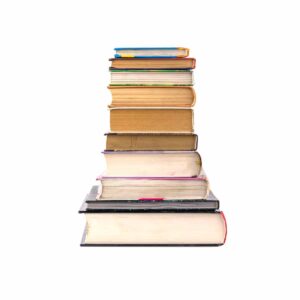
I want to click on hardcover books, so click(169, 54), click(173, 62), click(181, 79), click(171, 92), click(163, 116), click(167, 143), click(166, 163), click(169, 190), click(170, 208), click(172, 220).